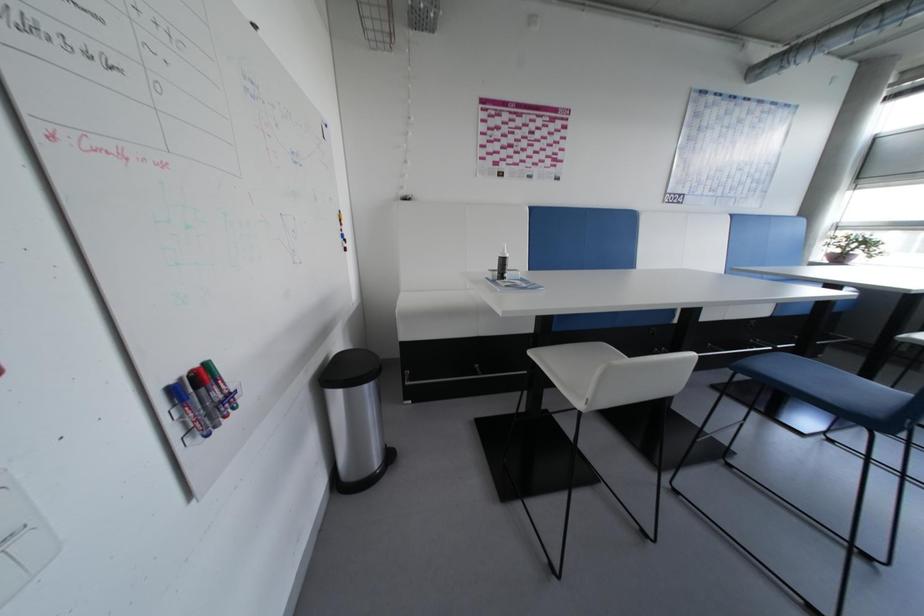
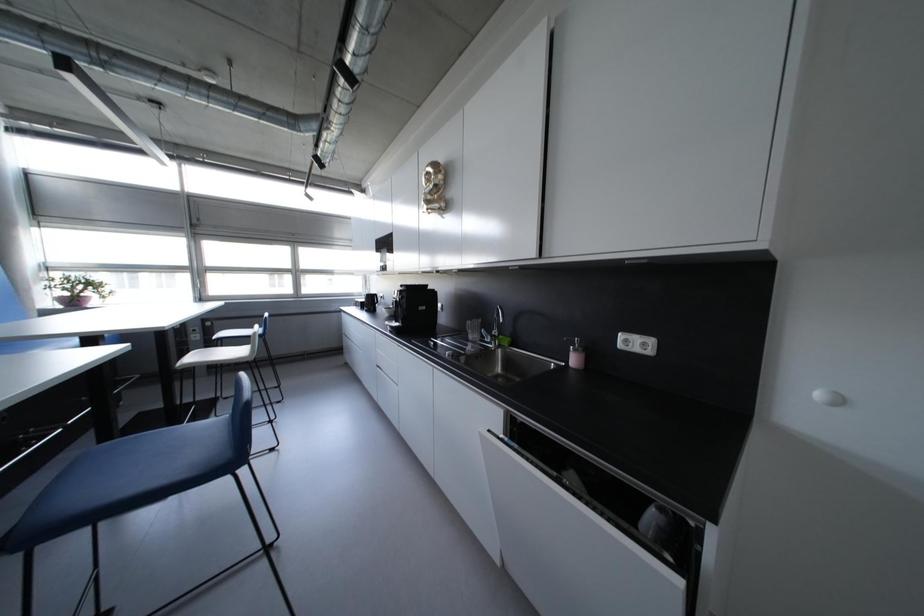
Question: The camera is either moving clockwise (left) or counter-clockwise (right) around the object. The first image is from the beginning of the video and the second image is from the end. Is the camera moving left or right when shooting the video?

Choices:
 (A) Left
 (B) Right

Answer: (A)